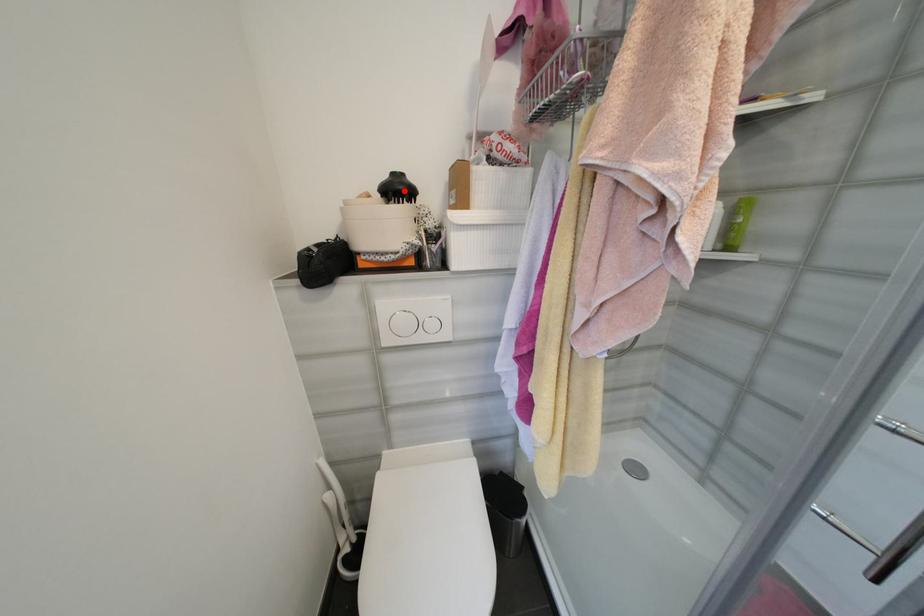
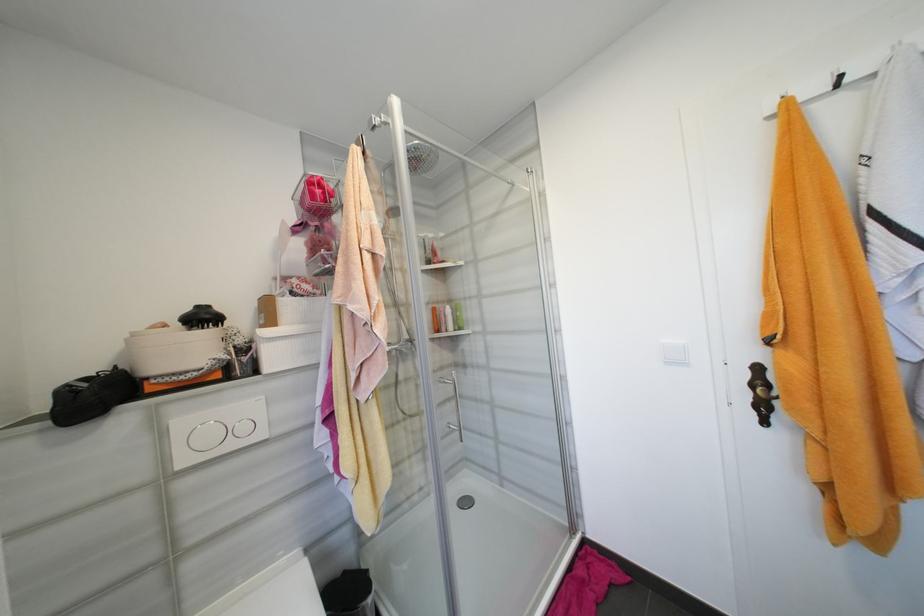
Locate, in the second image, the point that corresponds to the highlighted location in the first image.

(210, 318)